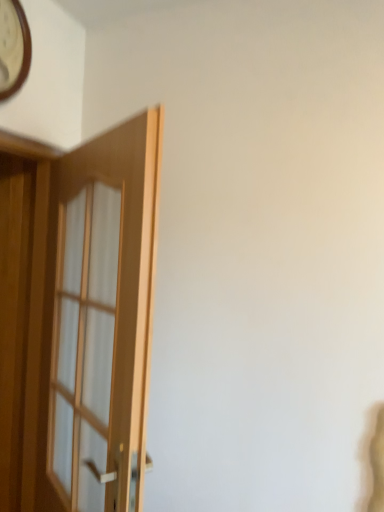
Question: Does wooden clock at upper left have a greater height compared to light brown wooden door at left?

Choices:
 (A) no
 (B) yes

Answer: (A)

Question: Can you confirm if wooden clock at upper left is thinner than light brown wooden door at left?

Choices:
 (A) no
 (B) yes

Answer: (B)

Question: Does wooden clock at upper left have a lesser height compared to light brown wooden door at left?

Choices:
 (A) yes
 (B) no

Answer: (A)

Question: Is there a large distance between wooden clock at upper left and light brown wooden door at left?

Choices:
 (A) no
 (B) yes

Answer: (A)

Question: Is wooden clock at upper left turned away from light brown wooden door at left?

Choices:
 (A) yes
 (B) no

Answer: (B)

Question: Is wooden clock at upper left aimed at light brown wooden door at left?

Choices:
 (A) yes
 (B) no

Answer: (B)

Question: Can wooden clock at upper left be found inside light brown wooden door at left?

Choices:
 (A) no
 (B) yes

Answer: (A)

Question: From a real-world perspective, is light brown wooden door at left located higher than wooden clock at upper left?

Choices:
 (A) yes
 (B) no

Answer: (B)

Question: Is light brown wooden door at left smaller than wooden clock at upper left?

Choices:
 (A) yes
 (B) no

Answer: (B)

Question: Is light brown wooden door at left outside of wooden clock at upper left?

Choices:
 (A) no
 (B) yes

Answer: (B)

Question: Considering the relative sizes of light brown wooden door at left and wooden clock at upper left in the image provided, is light brown wooden door at left thinner than wooden clock at upper left?

Choices:
 (A) no
 (B) yes

Answer: (A)

Question: Does light brown wooden door at left appear on the left side of wooden clock at upper left?

Choices:
 (A) yes
 (B) no

Answer: (B)

Question: From the image's perspective, is light brown wooden door at left positioned above or below wooden clock at upper left?

Choices:
 (A) below
 (B) above

Answer: (A)